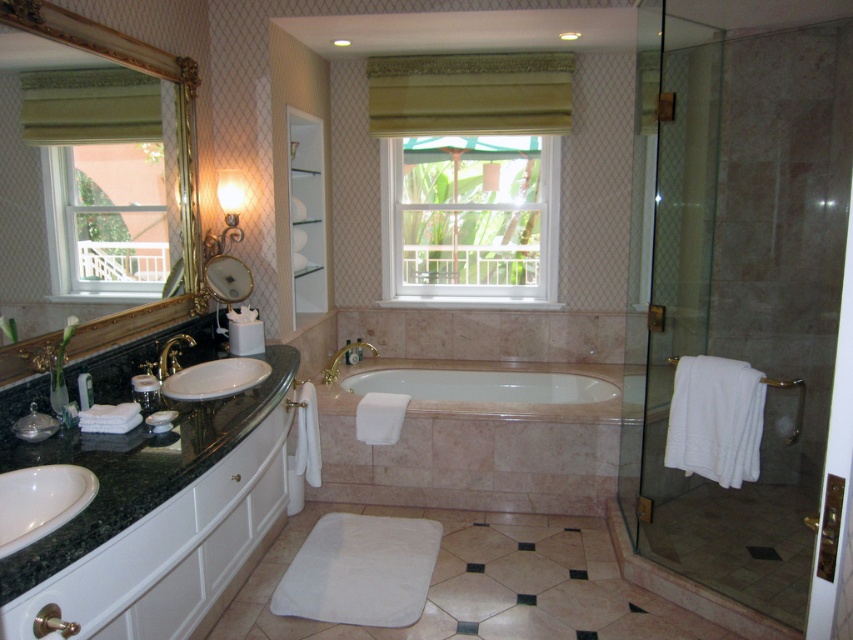
Where is `white wooden window at center`? The width and height of the screenshot is (853, 640). white wooden window at center is located at coordinates (469, 220).

Who is more forward, (546, 189) or (347, 348)?

Point (347, 348) is more forward.

Is point (433, 140) farther from camera compared to point (345, 346)?

That is True.

Locate an element on the screen. This screenshot has height=640, width=853. white wooden window at center is located at coordinates (469, 220).

Who is positioned more to the right, transparent glass shower door at right or glossy metallic mirror at upper center?

Positioned to the right is transparent glass shower door at right.

Is transparent glass shower door at right positioned before glossy metallic mirror at upper center?

Yes, transparent glass shower door at right is closer to the viewer.

Who is more forward, (x=664, y=205) or (x=209, y=262)?

Point (x=209, y=262) is more forward.

The image size is (853, 640). Find the location of `transparent glass shower door at right`. transparent glass shower door at right is located at coordinates (740, 273).

Does gold-framed mirror at upper left appear on the right side of white glossy sink at left?

Incorrect, gold-framed mirror at upper left is not on the right side of white glossy sink at left.

Can you confirm if gold-framed mirror at upper left is wider than white glossy sink at left?

In fact, gold-framed mirror at upper left might be narrower than white glossy sink at left.

Who is more distant from viewer, (175, 97) or (207, 371)?

The point (175, 97) is more distant.

At what (x,y) coordinates should I click in order to perform the action: click on gold-framed mirror at upper left. Please return your answer as a coordinate pair (x, y). Looking at the image, I should click on (177, 147).